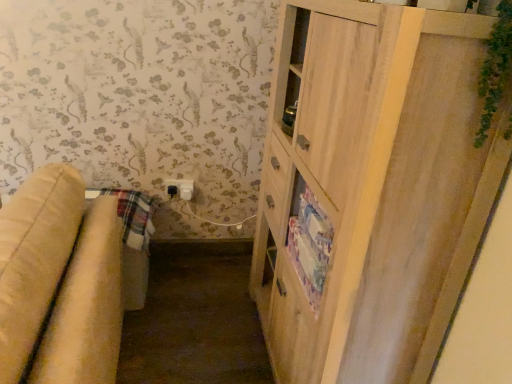
Describe the element at coordinates (60, 282) in the screenshot. This screenshot has height=384, width=512. I see `beige fabric studio couch at left` at that location.

Image resolution: width=512 pixels, height=384 pixels. Find the location of `white plastic electric outlet at lower center`. white plastic electric outlet at lower center is located at coordinates (180, 188).

This screenshot has height=384, width=512. I want to click on studio couch located below the white plastic electric outlet at lower center (from the image's perspective), so click(x=60, y=282).

How many degrees apart are the facing directions of white plastic electric outlet at lower center and beige fabric studio couch at left?

They differ by 87.6 degrees in their facing directions.

Is white plastic electric outlet at lower center far away from beige fabric studio couch at left?

Yes, white plastic electric outlet at lower center is far from beige fabric studio couch at left.

How far apart are white plastic electric outlet at lower center and beige fabric studio couch at left?

The distance of white plastic electric outlet at lower center from beige fabric studio couch at left is 1.12 meters.

How much distance is there between beige fabric studio couch at left and light wood cabinet at right?

beige fabric studio couch at left is 28.30 inches away from light wood cabinet at right.

Is beige fabric studio couch at left bigger or smaller than light wood cabinet at right?

In the image, beige fabric studio couch at left appears to be larger than light wood cabinet at right.

Which is behind, point (121, 316) or point (347, 82)?

Point (121, 316)

From the picture: In the image, is beige fabric studio couch at left positioned in front of or behind light wood cabinet at right?

In the image, beige fabric studio couch at left appears in front of light wood cabinet at right.

Is beige fabric studio couch at left oriented towards white plastic electric outlet at lower center?

No.

Is point (42, 365) behind point (168, 187)?

No, it is not.

Is beige fabric studio couch at left further to camera compared to white plastic electric outlet at lower center?

That is False.

Considering the relative sizes of beige fabric studio couch at left and white plastic electric outlet at lower center in the image provided, is beige fabric studio couch at left smaller than white plastic electric outlet at lower center?

No.

Can you confirm if light wood cabinet at right is bigger than white plastic electric outlet at lower center?

Correct, light wood cabinet at right is larger in size than white plastic electric outlet at lower center.

The width and height of the screenshot is (512, 384). What are the coordinates of `cupboard above the white plastic electric outlet at lower center (from a real-world perspective)` in the screenshot? It's located at (373, 187).

Which object is thinner, light wood cabinet at right or white plastic electric outlet at lower center?

Thinner between the two is white plastic electric outlet at lower center.

Between light wood cabinet at right and beige fabric studio couch at left, which one has more height?

With more height is light wood cabinet at right.

Are light wood cabinet at right and beige fabric studio couch at left located far from each other?

light wood cabinet at right is actually quite close to beige fabric studio couch at left.

In the image, is light wood cabinet at right on the left side or the right side of beige fabric studio couch at left?

In the image, light wood cabinet at right appears on the right side of beige fabric studio couch at left.

Is beige fabric studio couch at left at the back of light wood cabinet at right?

No, light wood cabinet at right is not facing away from beige fabric studio couch at left.

Is white plastic electric outlet at lower center shorter than light wood cabinet at right?

Correct, white plastic electric outlet at lower center is not as tall as light wood cabinet at right.

Does white plastic electric outlet at lower center turn towards light wood cabinet at right?

No, white plastic electric outlet at lower center is not aimed at light wood cabinet at right.

Which point is more distant from viewer, (192,195) or (402,342)?

Positioned behind is point (192,195).

At what (x,y) coordinates should I click in order to perform the action: click on cupboard located above the white plastic electric outlet at lower center (from a real-world perspective). Please return your answer as a coordinate pair (x, y). The image size is (512, 384). Looking at the image, I should click on (373, 187).

You are a GUI agent. You are given a task and a screenshot of the screen. Output one action in this format:
    pyautogui.click(x=<x>, y=<y>)
    Task: Click on the studio couch on the left side of white plastic electric outlet at lower center
    This screenshot has width=512, height=384.
    Given the screenshot: What is the action you would take?
    pyautogui.click(x=60, y=282)

At what (x,y) coordinates should I click in order to perform the action: click on studio couch lying in front of the light wood cabinet at right. Please return your answer as a coordinate pair (x, y). The height and width of the screenshot is (384, 512). Looking at the image, I should click on (60, 282).

When comparing their distances from light wood cabinet at right, does white plastic electric outlet at lower center or beige fabric studio couch at left seem further?

white plastic electric outlet at lower center lies further to light wood cabinet at right than the other object.

Estimate the real-world distances between objects in this image. Which object is further from beige fabric studio couch at left, light wood cabinet at right or white plastic electric outlet at lower center?

Among the two, white plastic electric outlet at lower center is located further to beige fabric studio couch at left.

From the picture: When comparing their distances from light wood cabinet at right, does beige fabric studio couch at left or white plastic electric outlet at lower center seem closer?

The object closer to light wood cabinet at right is beige fabric studio couch at left.

From the image, which object appears to be nearer to white plastic electric outlet at lower center, light wood cabinet at right or beige fabric studio couch at left?

Among the two, beige fabric studio couch at left is located nearer to white plastic electric outlet at lower center.

Estimate the real-world distances between objects in this image. Which object is closer to beige fabric studio couch at left, white plastic electric outlet at lower center or light wood cabinet at right?

The object closer to beige fabric studio couch at left is light wood cabinet at right.

Which object lies further to the anchor point white plastic electric outlet at lower center, beige fabric studio couch at left or light wood cabinet at right?

The object further to white plastic electric outlet at lower center is light wood cabinet at right.

This screenshot has width=512, height=384. In order to click on cupboard positioned between beige fabric studio couch at left and white plastic electric outlet at lower center from near to far in this screenshot , I will do `click(373, 187)`.